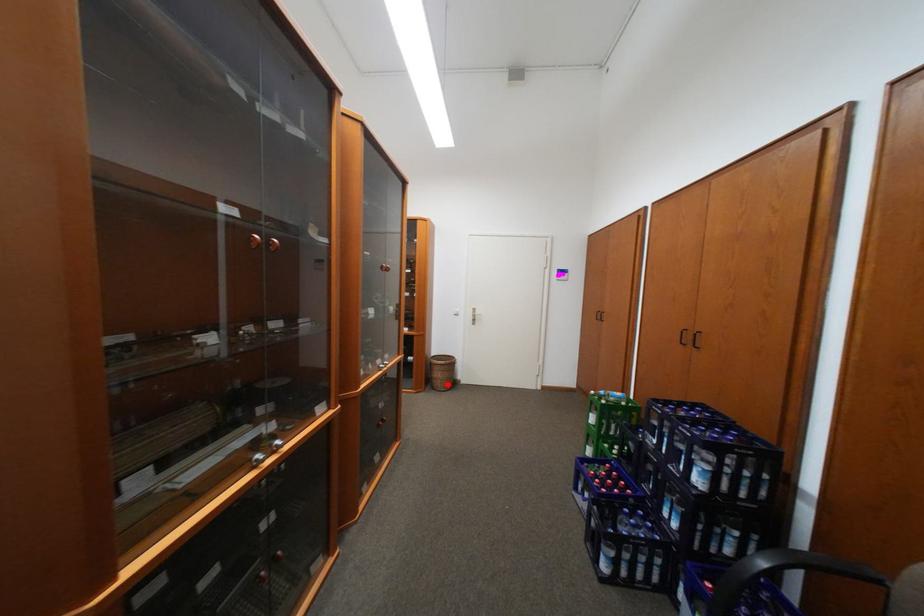
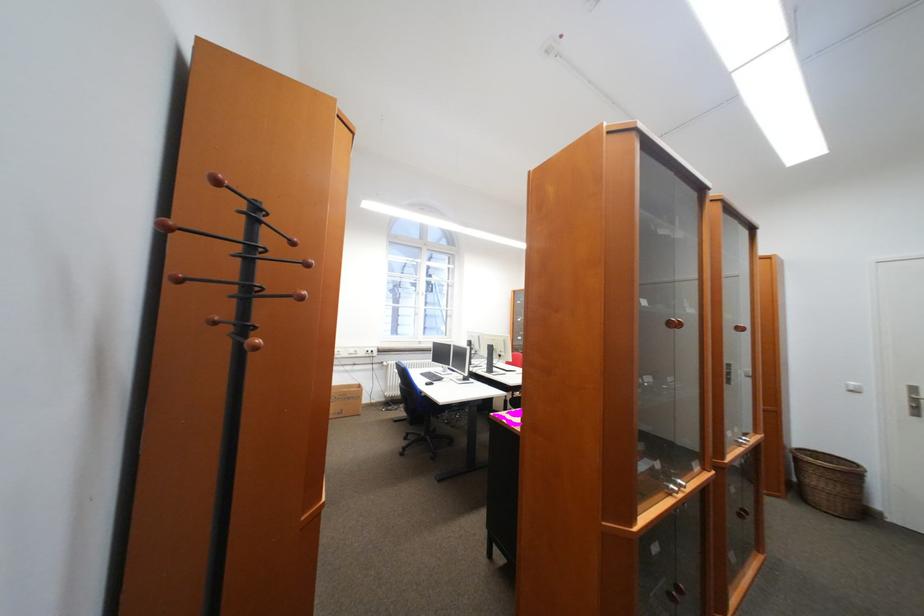
Locate, in the second image, the point that corresponds to the highlighted location in the first image.

(830, 499)